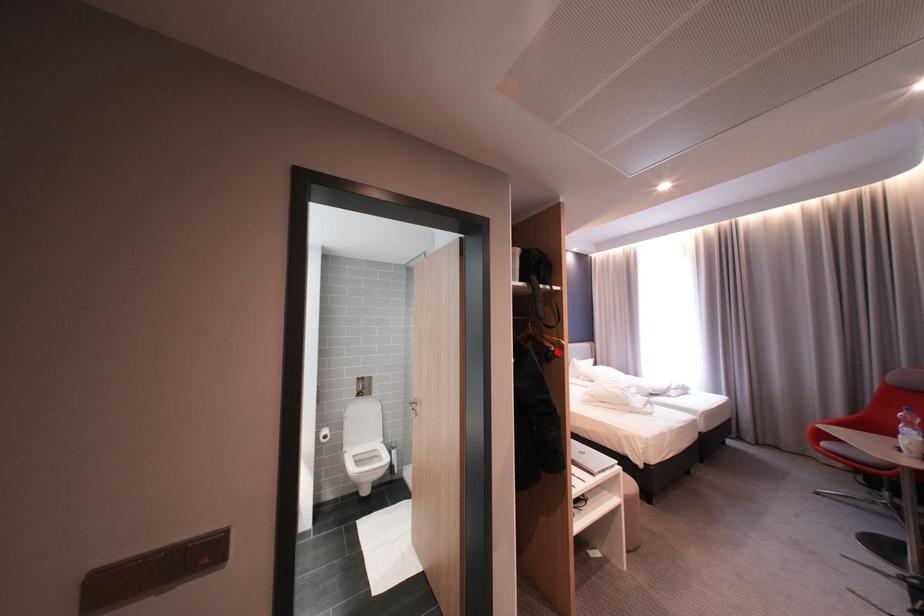
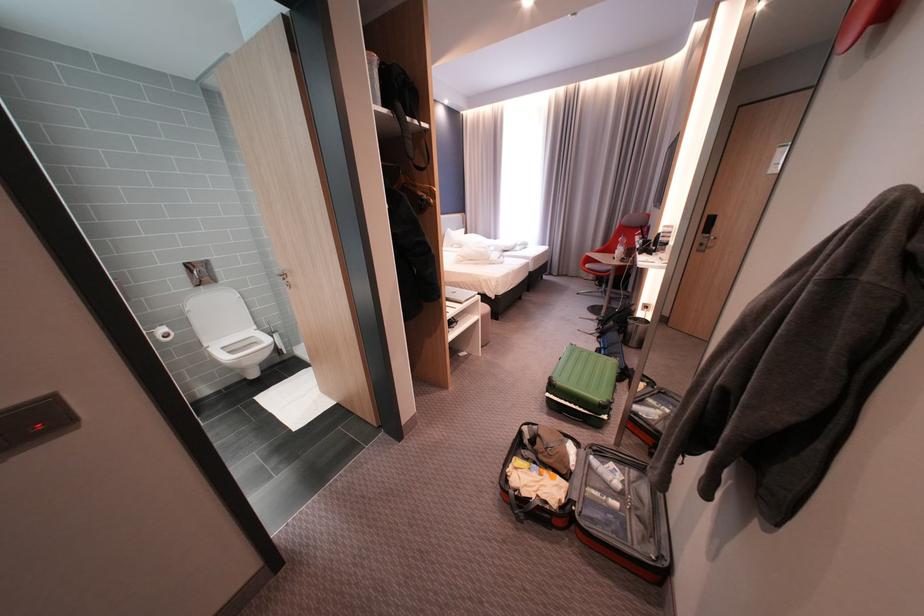
The point at the highlighted location is marked in the first image. Where is the corresponding point in the second image?

(431, 203)